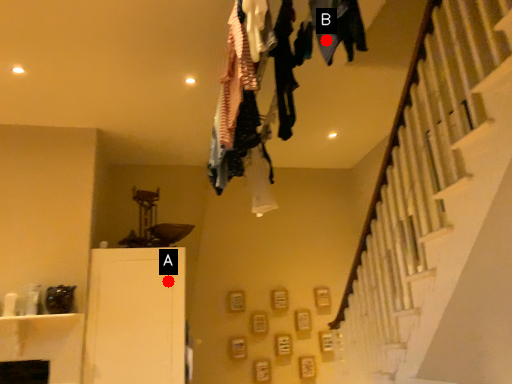
Question: Two points are circled on the image, labeled by A and B beside each circle. Which point is closer to the camera?

Choices:
 (A) A is closer
 (B) B is closer

Answer: (B)